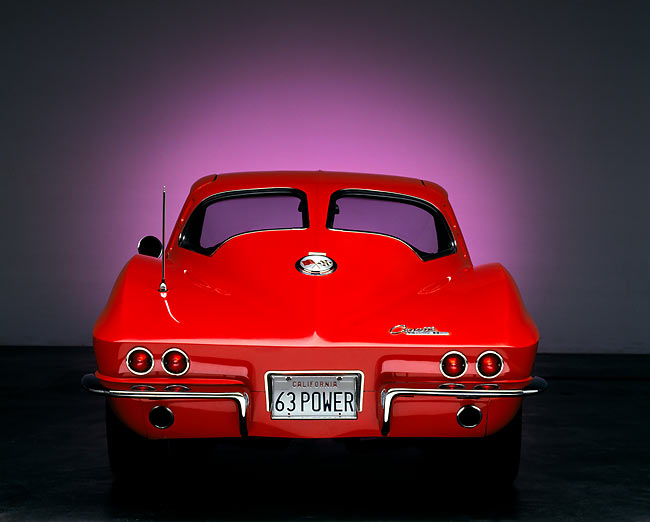
Locate an element on the screen. The height and width of the screenshot is (522, 650). the back lights is located at coordinates (138, 359), (176, 362), (456, 367), (491, 364).